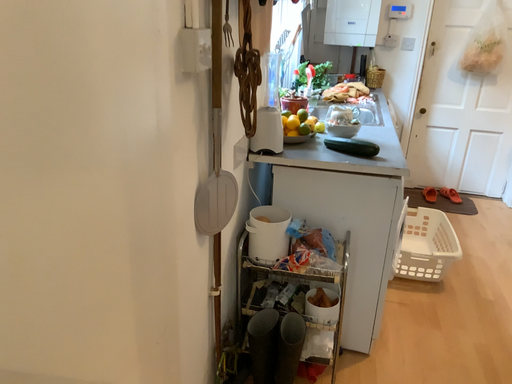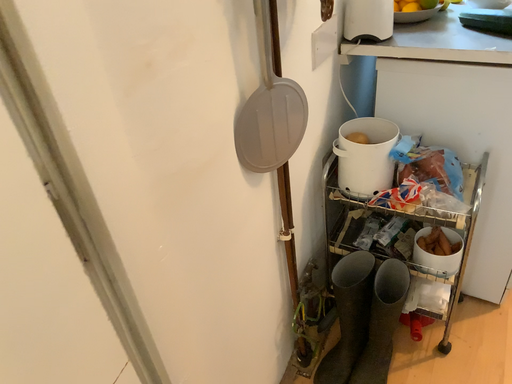
Question: How did the camera likely rotate when shooting the video?

Choices:
 (A) rotated downward
 (B) rotated upward

Answer: (A)